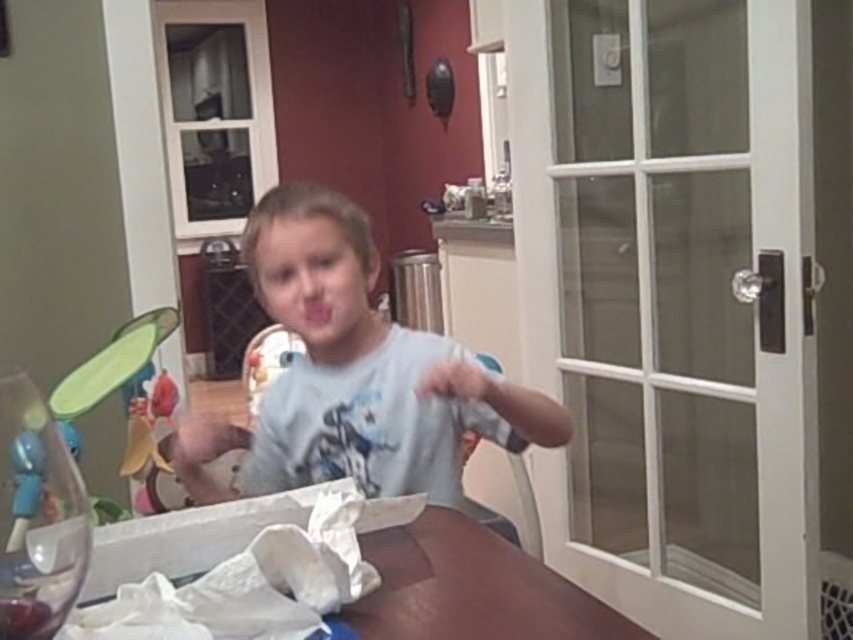
Is point (459, 458) positioned after point (303, 305)?

Yes.

Where is `white cotton shirt at center`? The height and width of the screenshot is (640, 853). white cotton shirt at center is located at coordinates (354, 374).

The width and height of the screenshot is (853, 640). Find the location of `white cotton shirt at center`. white cotton shirt at center is located at coordinates (354, 374).

Which is more to the left, white cotton shirt at center or wooden table at lower center?

white cotton shirt at center is more to the left.

Who is more forward, (x=483, y=396) or (x=444, y=630)?

Point (x=444, y=630) is in front.

You are a GUI agent. You are given a task and a screenshot of the screen. Output one action in this format:
    pyautogui.click(x=<x>, y=<y>)
    Task: Click on the white cotton shirt at center
    The image size is (853, 640).
    Given the screenshot: What is the action you would take?
    pos(354,374)

Looking at this image, who is taller, transparent plastic wine glass at lower left or pink matte mouth at center?

transparent plastic wine glass at lower left

Who is positioned more to the left, transparent plastic wine glass at lower left or pink matte mouth at center?

transparent plastic wine glass at lower left is more to the left.

Does point (33, 496) lie behind point (318, 314)?

No, (33, 496) is in front of (318, 314).

Identify the location of transparent plastic wine glass at lower left. The height and width of the screenshot is (640, 853). (38, 516).